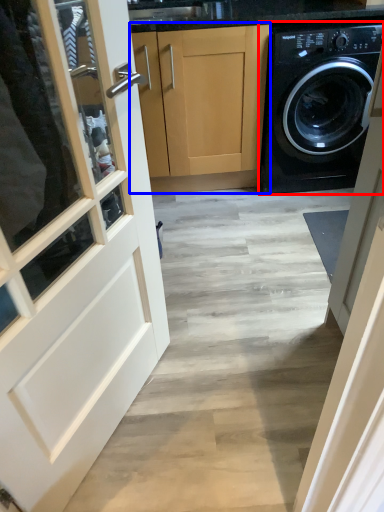
Question: Which of the following is the closest to the observer, washing machine (highlighted by a red box) or cabinetry (highlighted by a blue box)?

Choices:
 (A) washing machine
 (B) cabinetry

Answer: (A)